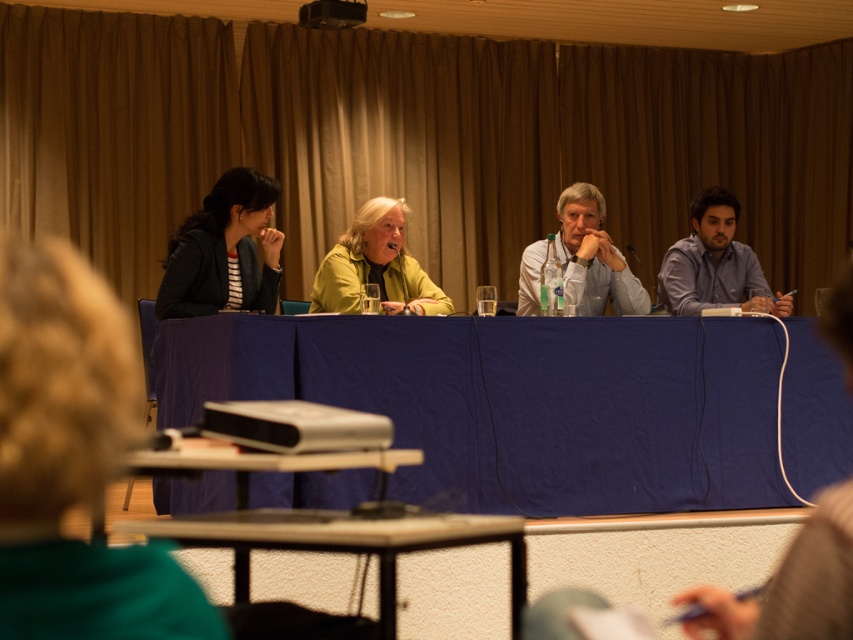
Is point (242, 580) more distant than point (689, 269)?

No.

From the picture: Does wooden table at lower center have a smaller size compared to blue shirt at right?

Yes.

Is point (132, 522) positioned in front of point (714, 256)?

Yes, point (132, 522) is in front of point (714, 256).

You are a GUI agent. You are given a task and a screenshot of the screen. Output one action in this format:
    pyautogui.click(x=<x>, y=<y>)
    Task: Click on the wooden table at lower center
    The width and height of the screenshot is (853, 640).
    Given the screenshot: What is the action you would take?
    pyautogui.click(x=343, y=544)

Does dark gray fabric jacket at left appear on the left side of blue shirt at right?

Indeed, dark gray fabric jacket at left is positioned on the left side of blue shirt at right.

Is dark gray fabric jacket at left to the right of blue shirt at right from the viewer's perspective?

In fact, dark gray fabric jacket at left is to the left of blue shirt at right.

Is point (224, 182) positioned before point (720, 198)?

Yes, point (224, 182) is in front of point (720, 198).

Where is `dark gray fabric jacket at left`? This screenshot has height=640, width=853. dark gray fabric jacket at left is located at coordinates (223, 250).

Does wooden table at lower center come in front of white shirt at center?

Yes, it is in front of white shirt at center.

Which is below, wooden table at lower center or white shirt at center?

wooden table at lower center

What do you see at coordinates (343, 544) in the screenshot? This screenshot has height=640, width=853. I see `wooden table at lower center` at bounding box center [343, 544].

Where is `wooden table at lower center`? This screenshot has width=853, height=640. wooden table at lower center is located at coordinates (343, 544).